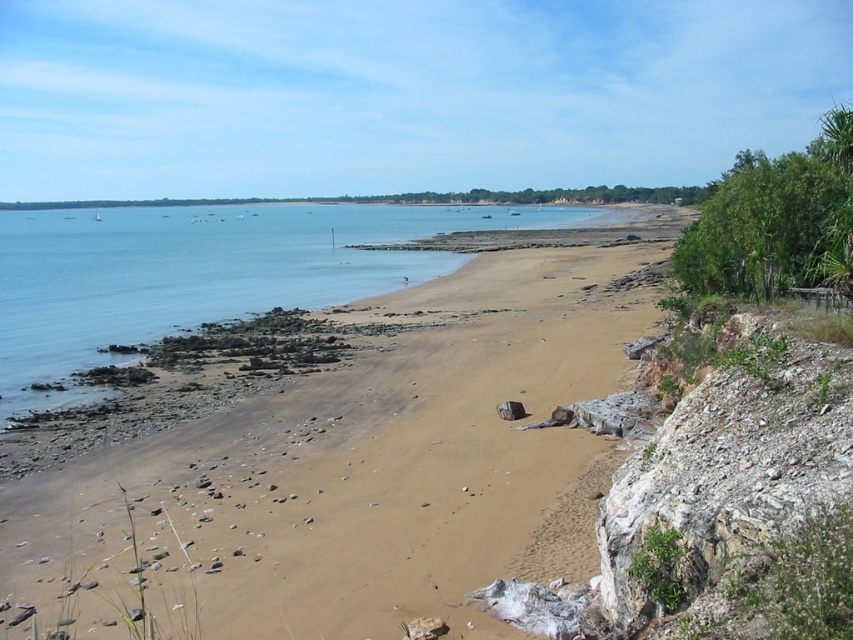
You are standing on the brown sand at center and want to reach the blue water at center. According to the scene description, which direction should you move in to get to the water?

The brown sand at center is located below the blue water at center, so you should move upward to reach the blue water at center.

You are standing on the beach looking out at the bay. There are two points marked in the scene. The first point is at coordinates point (334, 580) and the second is at point (135, 304). Which point is closer to you?

Point (334, 580) is closer to the viewer than point (135, 304).